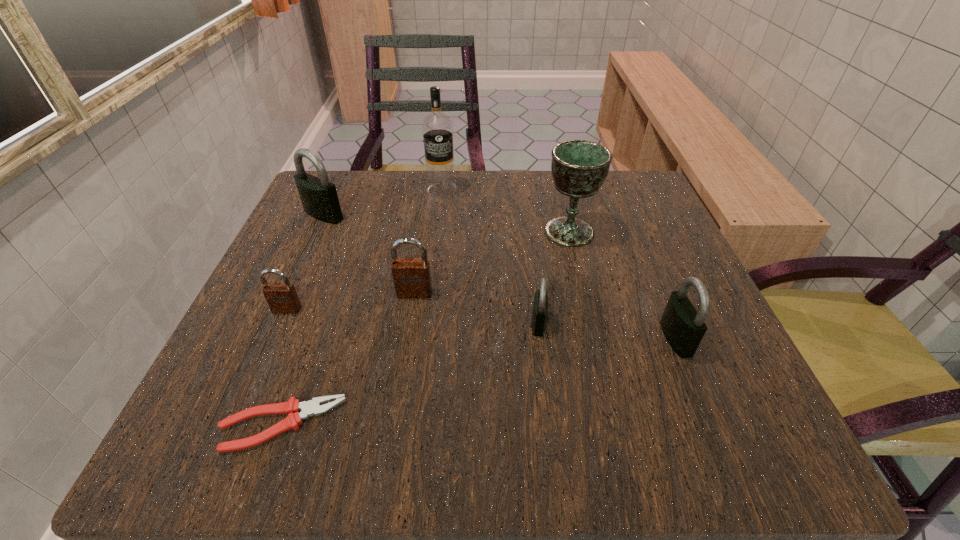
Where is `the fourth padlock from left to right`? the fourth padlock from left to right is located at coordinates (540, 304).

What are the coordinates of `the left brown padlock` in the screenshot? It's located at (282, 298).

The height and width of the screenshot is (540, 960). I want to click on the nearer brown padlock, so click(x=282, y=298).

At what (x,y) coordinates should I click in order to perform the action: click on pliers. Please return your answer as a coordinate pair (x, y). Looking at the image, I should click on (292, 407).

Image resolution: width=960 pixels, height=540 pixels. I want to click on the shortest object, so click(x=292, y=407).

This screenshot has width=960, height=540. What are the coordinates of `free space located 0.110m on the label of the tallest object` in the screenshot? It's located at (437, 228).

Where is `vacant region located 0.100m on the left of the seventh object from left to right`? vacant region located 0.100m on the left of the seventh object from left to right is located at coordinates (493, 232).

The image size is (960, 540). In order to click on free space located on the right of the tallest padlock in this screenshot , I will do `click(412, 215)`.

The width and height of the screenshot is (960, 540). In order to click on free region located on the front-facing side of the right brown padlock in this screenshot , I will do `click(399, 390)`.

I want to click on free space located 0.090m on the left of the rightmost object, so click(x=608, y=339).